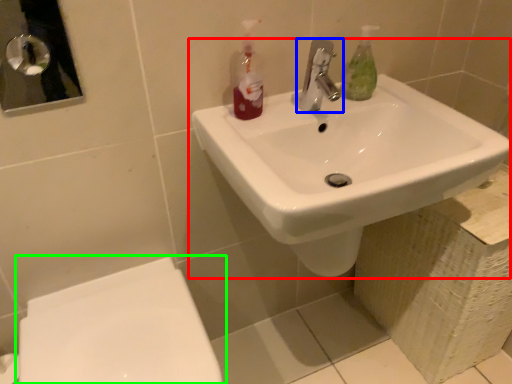
Question: Based on their relative distances, which object is farther from sink (highlighted by a red box)? Choose from tap (highlighted by a blue box) and toilet (highlighted by a green box).

Choices:
 (A) tap
 (B) toilet

Answer: (B)